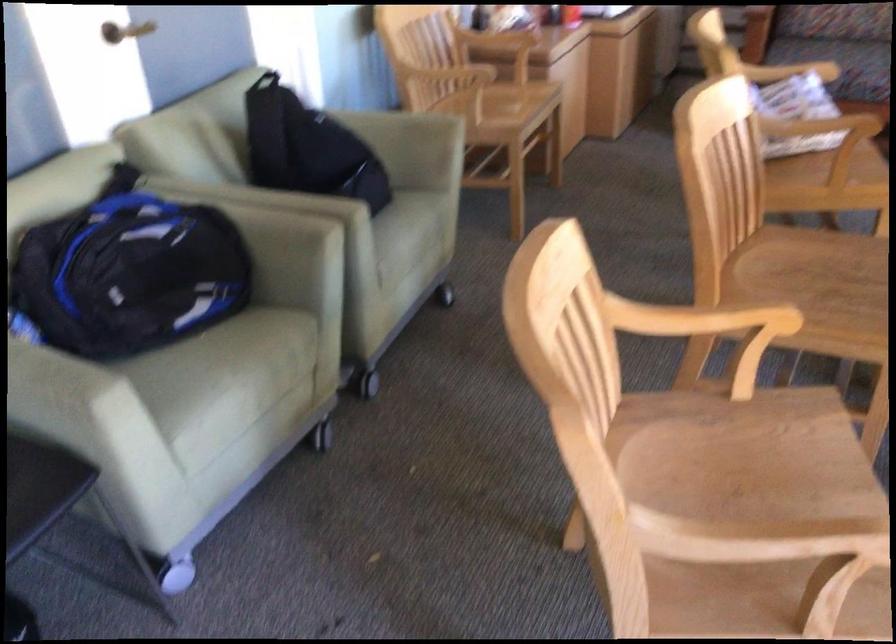
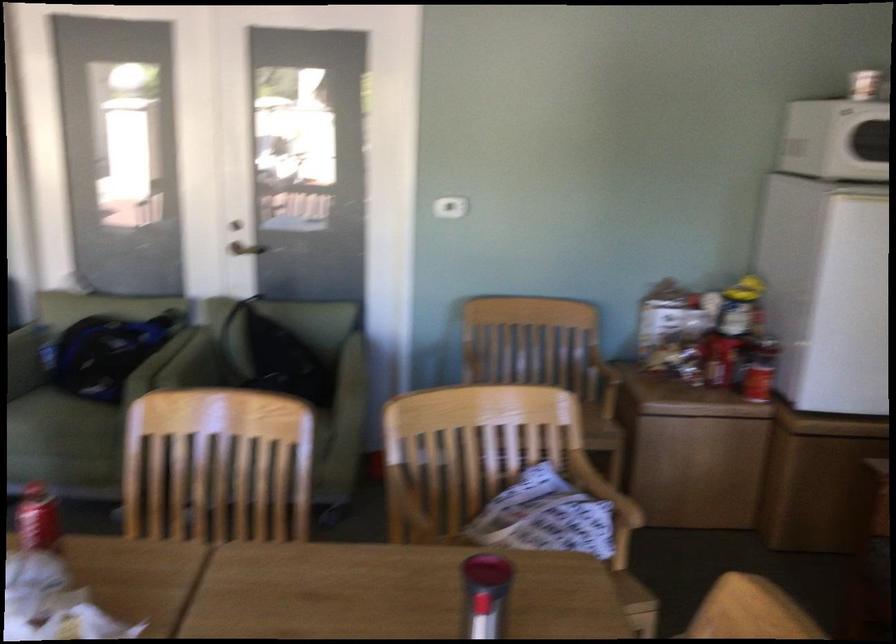
Question: I am providing you with two images of the same scene from different viewpoints. Which of the following objects are not visible in image2?

Choices:
 (A) sofa sitting surface
 (B) wooden cabinet lid
 (C) white tray handle
 (D) caster wheel

Answer: (D)